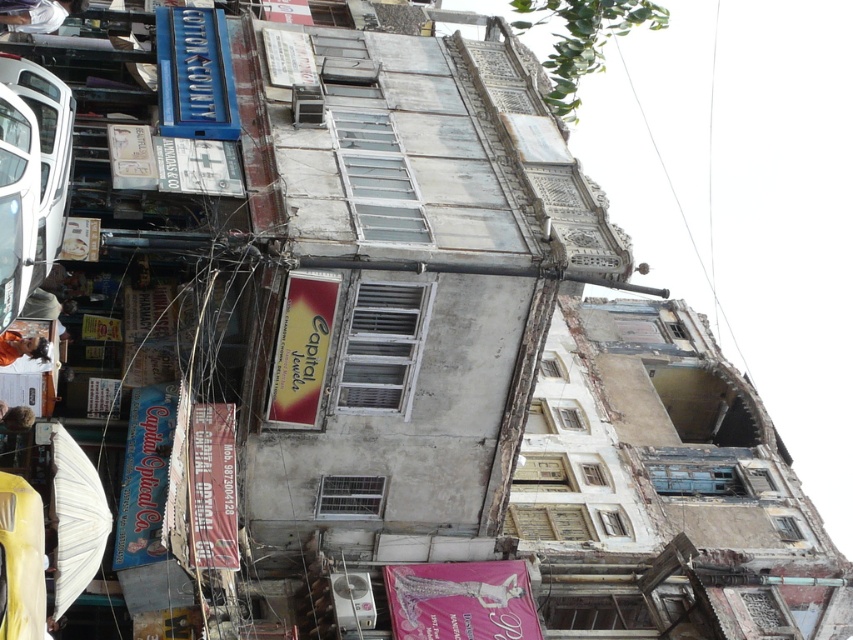
Question: Estimate the real-world distances between objects in this image. Which object is closer to the white glossy car at left?

Choices:
 (A) light brown hair at lower left
 (B) metallic gold necklace at lower left
 (C) white fabric shirt at upper left

Answer: (B)

Question: In this image, where is white fabric shirt at upper left located relative to metallic gold necklace at lower left?

Choices:
 (A) below
 (B) above

Answer: (B)

Question: Which of the following is the closest to the observer?

Choices:
 (A) (10, 426)
 (B) (67, 12)
 (C) (48, 124)

Answer: (C)

Question: Is white fabric shirt at upper left wider than light brown hair at lower left?

Choices:
 (A) yes
 (B) no

Answer: (A)

Question: Can you confirm if white fabric shirt at upper left is bigger than light brown hair at lower left?

Choices:
 (A) yes
 (B) no

Answer: (A)

Question: Which object appears closest to the camera in this image?

Choices:
 (A) white fabric shirt at upper left
 (B) metallic gold necklace at lower left
 (C) white glossy car at left
 (D) light brown hair at lower left

Answer: (C)